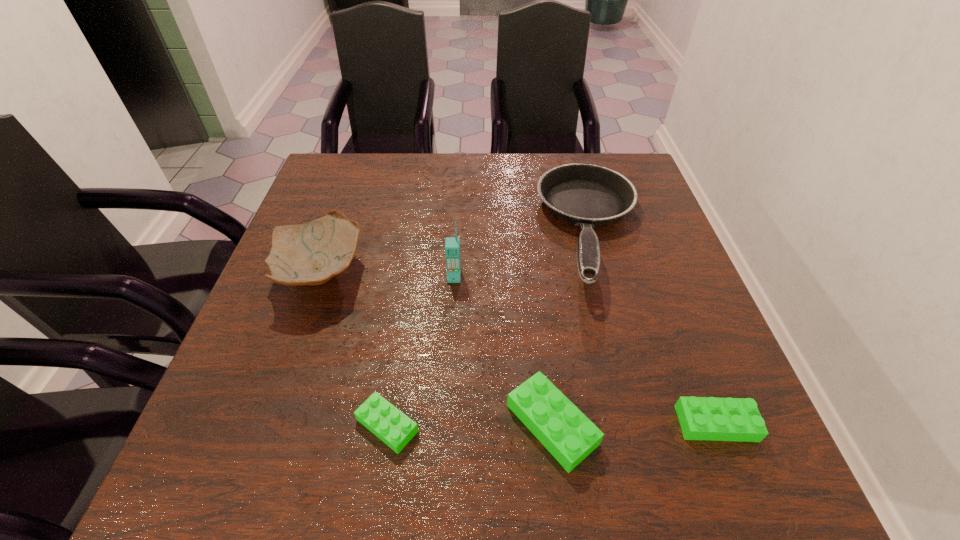
This screenshot has height=540, width=960. What are the coordinates of `the leftmost Lego` in the screenshot? It's located at (389, 424).

What are the coordinates of `the fifth object from right to left` in the screenshot? It's located at (389, 424).

This screenshot has width=960, height=540. In order to click on the tallest Lego in this screenshot , I will do `click(554, 420)`.

The height and width of the screenshot is (540, 960). I want to click on the second Lego from left to right, so click(x=554, y=420).

Find the location of a particular element. This screenshot has height=540, width=960. the second tallest Lego is located at coordinates (701, 418).

At what (x,y) coordinates should I click in order to perform the action: click on the second shortest object. Please return your answer as a coordinate pair (x, y). The height and width of the screenshot is (540, 960). Looking at the image, I should click on click(701, 418).

I want to click on the third object from left to right, so click(x=452, y=244).

I want to click on the tallest object, so click(x=452, y=244).

The image size is (960, 540). Identify the location of frying pan. (587, 195).

Find the location of a particular element. The height and width of the screenshot is (540, 960). the leftmost object is located at coordinates (312, 253).